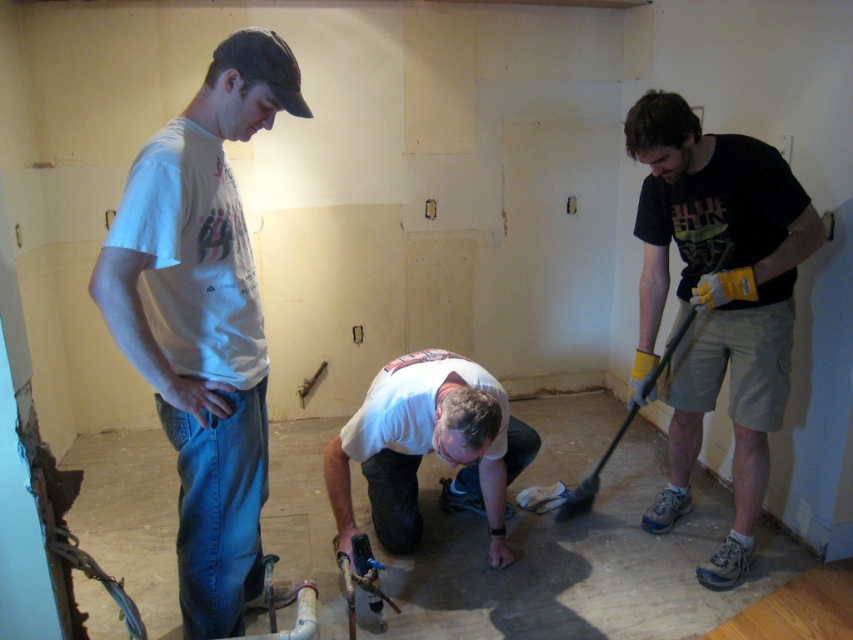
Question: Can you confirm if white cotton t-shirt at center is positioned to the right of white matte shirt at center?

Choices:
 (A) yes
 (B) no

Answer: (B)

Question: Which of the following is the closest to the observer?

Choices:
 (A) (465, 372)
 (B) (138, 316)
 (C) (395, 560)
 (D) (791, 275)

Answer: (B)

Question: From the image, what is the correct spatial relationship of white cotton t-shirt at center in relation to white matte shirt at center?

Choices:
 (A) left
 (B) right

Answer: (A)

Question: Which of the following is the closest to the observer?

Choices:
 (A) (641, 236)
 (B) (410, 392)
 (C) (454, 580)
 (D) (245, 428)

Answer: (D)

Question: Is black cotton t-shirt at right below white matte shirt at center?

Choices:
 (A) no
 (B) yes

Answer: (A)

Question: Which of the following is the farthest from the observer?

Choices:
 (A) coord(546,608)
 (B) coord(798,236)

Answer: (A)